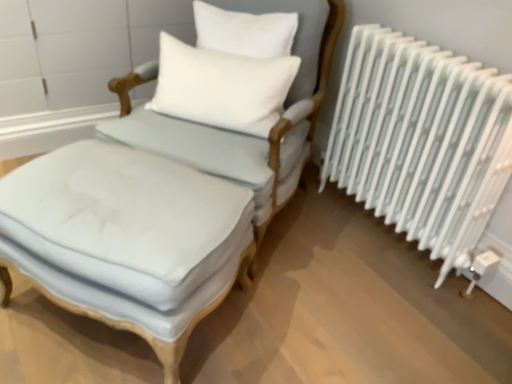
Identify the location of light blue fabric chair at center. The width and height of the screenshot is (512, 384). (159, 213).

The width and height of the screenshot is (512, 384). What are the coordinates of `white soft cushion at upper center` in the screenshot? It's located at (222, 87).

At what (x,y) coordinates should I click in order to perform the action: click on light blue fabric armchair at center. Please return your answer as a coordinate pair (x, y). Image resolution: width=512 pixels, height=384 pixels. Looking at the image, I should click on (246, 132).

This screenshot has width=512, height=384. I want to click on light blue fabric chair at center, so click(x=159, y=213).

Find the location of a particular element. chair located underneath the white soft cushion at upper center (from a real-world perspective) is located at coordinates (159, 213).

Is light blue fabric chair at center shorter than white soft cushion at upper center?

Correct, light blue fabric chair at center is not as tall as white soft cushion at upper center.

Is light blue fabric chair at center turned away from white soft cushion at upper center?

No, light blue fabric chair at center is not facing away from white soft cushion at upper center.

Is light blue fabric chair at center positioned behind white soft cushion at upper center?

No, it is in front of white soft cushion at upper center.

Is white soft cushion at upper center looking in the opposite direction of light blue fabric ottoman at center?

No, light blue fabric ottoman at center is not at the back of white soft cushion at upper center.

Locate an element on the screen. pillow above the light blue fabric ottoman at center (from the image's perspective) is located at coordinates (222, 87).

How many degrees apart are the facing directions of white soft cushion at upper center and light blue fabric ottoman at center?

4.23 degrees separate the facing orientations of white soft cushion at upper center and light blue fabric ottoman at center.

Looking at this image, in the image, is light blue fabric ottoman at center positioned in front of or behind light blue fabric chair at center?

Visually, light blue fabric ottoman at center is located behind light blue fabric chair at center.

Would you say light blue fabric ottoman at center is outside light blue fabric chair at center?

Absolutely, light blue fabric ottoman at center is external to light blue fabric chair at center.

Is point (228, 225) closer or farther from the camera than point (246, 163)?

Clearly, point (228, 225) is closer to the camera than point (246, 163).

The height and width of the screenshot is (384, 512). I want to click on mattress beneath the white metal radiator at right (from a real-world perspective), so click(x=125, y=219).

Considering the relative positions of white metal radiator at right and light blue fabric ottoman at center in the image provided, is white metal radiator at right to the left of light blue fabric ottoman at center from the viewer's perspective?

No, white metal radiator at right is not to the left of light blue fabric ottoman at center.

Is white metal radiator at right closer to the viewer compared to light blue fabric ottoman at center?

No, white metal radiator at right is further to the viewer.

In terms of width, does light blue fabric armchair at center look wider or thinner when compared to white soft cushion at upper center?

Clearly, light blue fabric armchair at center has more width compared to white soft cushion at upper center.

Which is closer to the camera, (x=145, y=119) or (x=295, y=71)?

Point (x=145, y=119).

Considering the sizes of objects light blue fabric armchair at center and white soft cushion at upper center in the image provided, who is bigger, light blue fabric armchair at center or white soft cushion at upper center?

light blue fabric armchair at center is bigger.

From their relative heights in the image, would you say light blue fabric armchair at center is taller or shorter than light blue fabric ottoman at center?

Considering their sizes, light blue fabric armchair at center has more height than light blue fabric ottoman at center.

Considering the positions of objects light blue fabric armchair at center and light blue fabric ottoman at center in the image provided, who is in front, light blue fabric armchair at center or light blue fabric ottoman at center?

light blue fabric ottoman at center.

Is light blue fabric armchair at center inside or outside of light blue fabric ottoman at center?

light blue fabric armchair at center is located beyond the bounds of light blue fabric ottoman at center.

Is point (294, 164) closer or farther from the camera than point (55, 235)?

Point (294, 164) is farther from the camera than point (55, 235).

Where is `chair that is on the left side of light blue fabric armchair at center`? chair that is on the left side of light blue fabric armchair at center is located at coordinates (159, 213).

Looking at the image, does light blue fabric armchair at center seem bigger or smaller compared to light blue fabric chair at center?

Clearly, light blue fabric armchair at center is larger in size than light blue fabric chair at center.

Could you tell me if light blue fabric armchair at center is facing light blue fabric chair at center?

No, light blue fabric armchair at center does not turn towards light blue fabric chair at center.

From a real-world perspective, is light blue fabric armchair at center above or below light blue fabric chair at center?

light blue fabric armchair at center is above light blue fabric chair at center.

Locate an element on the screen. Image resolution: width=512 pixels, height=384 pixels. pillow on the right of light blue fabric chair at center is located at coordinates (222, 87).

Where is `mattress below the white soft cushion at upper center (from the image's perspective)`? The image size is (512, 384). mattress below the white soft cushion at upper center (from the image's perspective) is located at coordinates (125, 219).

When comparing their distances from light blue fabric chair at center, does white metal radiator at right or white soft cushion at upper center seem further?

Among the two, white metal radiator at right is located further to light blue fabric chair at center.

From the image, which object appears to be nearer to white soft cushion at upper center, light blue fabric chair at center or light blue fabric ottoman at center?

light blue fabric chair at center is closer to white soft cushion at upper center.

Based on their spatial positions, is white soft cushion at upper center or light blue fabric armchair at center closer to light blue fabric chair at center?

light blue fabric armchair at center.

When comparing their distances from light blue fabric chair at center, does light blue fabric ottoman at center or white metal radiator at right seem closer?

light blue fabric ottoman at center.

Based on their spatial positions, is white soft cushion at upper center or light blue fabric chair at center closer to light blue fabric armchair at center?

light blue fabric chair at center is positioned closer to the anchor light blue fabric armchair at center.

Looking at this image, estimate the real-world distances between objects in this image. Which object is further from light blue fabric chair at center, white soft cushion at upper center or white metal radiator at right?

Based on the image, white metal radiator at right appears to be further to light blue fabric chair at center.

When comparing their distances from light blue fabric armchair at center, does light blue fabric ottoman at center or white soft cushion at upper center seem closer?

white soft cushion at upper center lies closer to light blue fabric armchair at center than the other object.

Based on their spatial positions, is light blue fabric armchair at center or white soft cushion at upper center further from light blue fabric ottoman at center?

Among the two, white soft cushion at upper center is located further to light blue fabric ottoman at center.

This screenshot has height=384, width=512. Find the location of `mattress that lies between light blue fabric armchair at center and light blue fabric chair at center from top to bottom`. mattress that lies between light blue fabric armchair at center and light blue fabric chair at center from top to bottom is located at coordinates (125, 219).

Image resolution: width=512 pixels, height=384 pixels. In order to click on pillow between light blue fabric ottoman at center and white metal radiator at right in the horizontal direction in this screenshot , I will do tap(222, 87).

Locate an element on the screen. Image resolution: width=512 pixels, height=384 pixels. armchair located between light blue fabric ottoman at center and white metal radiator at right in the left-right direction is located at coordinates (246, 132).

In order to click on armchair between light blue fabric chair at center and white metal radiator at right in this screenshot , I will do `click(246, 132)`.